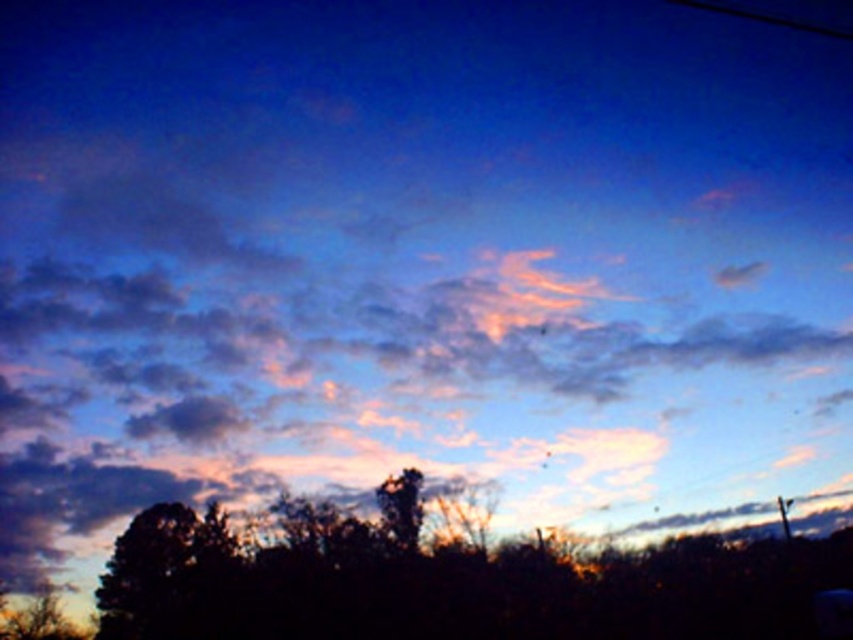
You are standing in the sunset scene and want to walk towards the trees. Which tree will you reach first, the dark green leafy tree at lower left or the smooth bark tree at center?

The dark green leafy tree at lower left is closer to you than the smooth bark tree at center, so you will reach the dark green leafy tree at lower left first.

You are standing in the middle of a forest clearing and see the dark brown textured tree at center and the dark green leafy tree at lower left. Which tree is closer to you?

The dark brown textured tree at center is closer to you because it is in front of the dark green leafy tree at lower left.

You are a bird looking for a place to perch. You see the dark brown textured tree at center and the smooth bark tree at center. Which tree is located below the other?

The dark brown textured tree at center is positioned under the smooth bark tree at center, so it is located below the other.